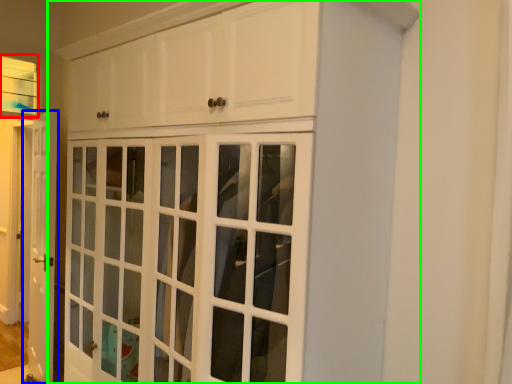
Question: Considering the real-world distances, which object is farthest from window (highlighted by a red box)? door (highlighted by a blue box) or cupboard (highlighted by a green box)?

Choices:
 (A) door
 (B) cupboard

Answer: (B)